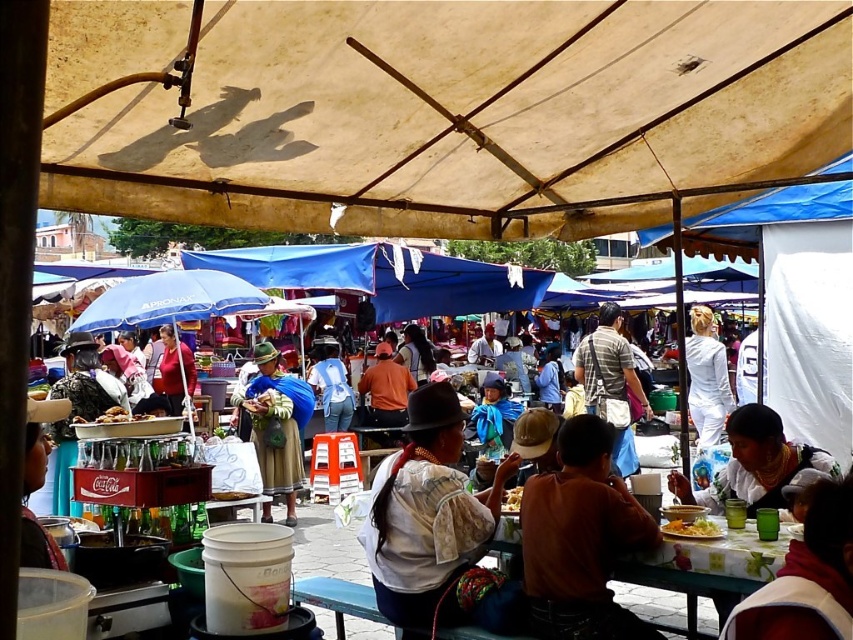
Question: Is beige canvas canopy at upper center thinner than white floral tablecloth at center?

Choices:
 (A) yes
 (B) no

Answer: (B)

Question: Which of the following is the farthest from the observer?

Choices:
 (A) (172, 173)
 (B) (712, 512)
 (C) (254, 355)

Answer: (C)

Question: Can you confirm if white floral tablecloth at center is positioned below white fabric at lower right?

Choices:
 (A) yes
 (B) no

Answer: (A)

Question: Which of these objects is positioned closest to the beige canvas canopy at upper center?

Choices:
 (A) yellow matte rice at lower center
 (B) yellowish matte food at center
 (C) blue woven skirt at center
 (D) brown fabric shirt at center

Answer: (D)

Question: Among these points, which one is nearest to the camera?

Choices:
 (A) (97, 422)
 (B) (689, 403)

Answer: (A)

Question: Can you confirm if brown fabric shirt at center is positioned above white fabric at lower right?

Choices:
 (A) no
 (B) yes

Answer: (A)